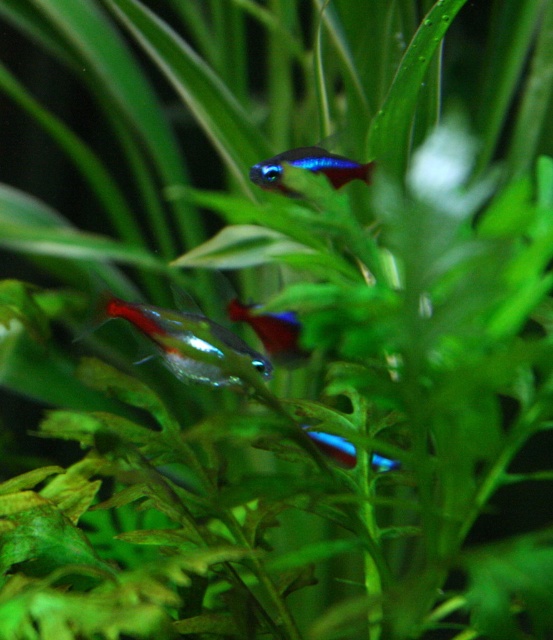
You are an underwater explorer observing the aquarium. You notice both the translucent glass fish at center and the shiny blue glass fish at center. Which one is located below the other?

The translucent glass fish at center is positioned under the shiny blue glass fish at center, so it is located below the other.

You are an underwater explorer observing the aquarium. You notice two fish at the center of the scene. Which one is positioned to the left when looking at the translucent glass fish at center and the blue glossy neon fish at center?

The translucent glass fish at center is positioned to the left of the blue glossy neon fish at center.